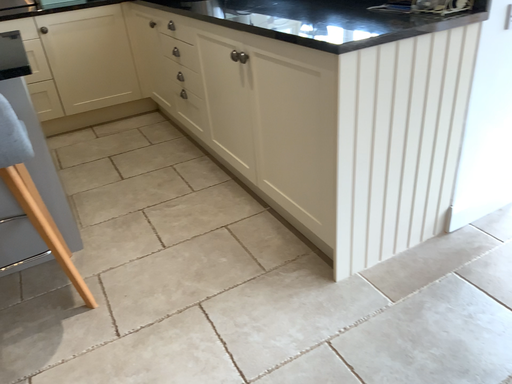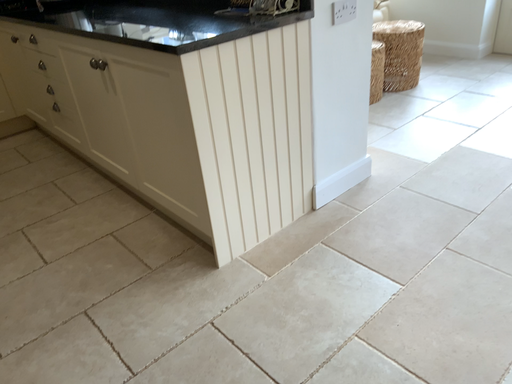
Question: How did the camera likely rotate when shooting the video?

Choices:
 (A) rotated left
 (B) rotated right

Answer: (B)